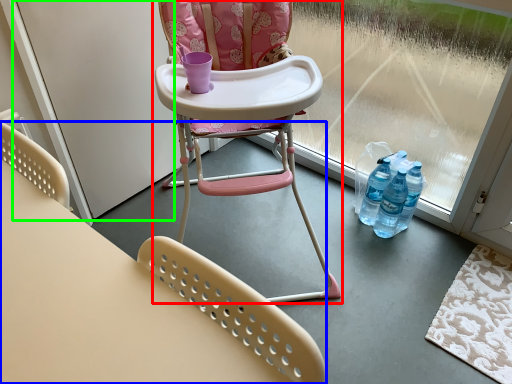
Question: Which object is the closest to the chair (highlighted by a red box)? Choose among these: chair (highlighted by a blue box) or screen door (highlighted by a green box).

Choices:
 (A) chair
 (B) screen door

Answer: (B)